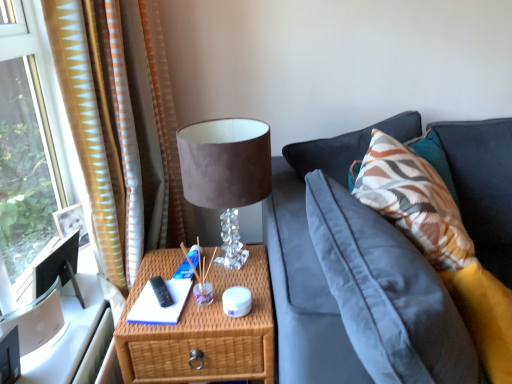
In order to click on gold striped curtain at left in this screenshot , I will do `click(121, 126)`.

Locate an element on the screen. The width and height of the screenshot is (512, 384). woven wood nightstand at lower center is located at coordinates (201, 329).

Which of these two, white paper at center or patterned fabric pillow at right, is bigger?

With larger size is patterned fabric pillow at right.

Does white paper at center turn towards patterned fabric pillow at right?

No, white paper at center is not aimed at patterned fabric pillow at right.

Is white paper at center next to patterned fabric pillow at right?

No, white paper at center is not next to patterned fabric pillow at right.

Is white paper at center outside of suede-like brown table lamp at upper center?

white paper at center is positioned outside suede-like brown table lamp at upper center.

Does white paper at center have a greater height compared to suede-like brown table lamp at upper center?

No, white paper at center is not taller than suede-like brown table lamp at upper center.

Does white paper at center have a greater width compared to suede-like brown table lamp at upper center?

In fact, white paper at center might be narrower than suede-like brown table lamp at upper center.

From the image's perspective, is white paper at center beneath suede-like brown table lamp at upper center?

Indeed, from the image's perspective, white paper at center is shown beneath suede-like brown table lamp at upper center.

Is gold striped curtain at left placed right next to suede-like brown table lamp at upper center?

No, gold striped curtain at left is not in contact with suede-like brown table lamp at upper center.

Is gold striped curtain at left taller than suede-like brown table lamp at upper center?

Yes, gold striped curtain at left is taller than suede-like brown table lamp at upper center.

How far apart are gold striped curtain at left and suede-like brown table lamp at upper center?

gold striped curtain at left is 36.32 centimeters from suede-like brown table lamp at upper center.

In the scene shown: In the image, is gold striped curtain at left positioned in front of or behind suede-like brown table lamp at upper center?

gold striped curtain at left is positioned farther from the viewer than suede-like brown table lamp at upper center.

Which object is more forward, suede-like brown table lamp at upper center or gold striped curtain at left?

Positioned in front is suede-like brown table lamp at upper center.

Can you confirm if suede-like brown table lamp at upper center is taller than gold striped curtain at left?

Incorrect, the height of suede-like brown table lamp at upper center is not larger of that of gold striped curtain at left.

Locate an element on the screen. curtain behind the suede-like brown table lamp at upper center is located at coordinates (121, 126).

Does white paper at center have a smaller size compared to woven wood nightstand at lower center?

Correct, white paper at center occupies less space than woven wood nightstand at lower center.

Locate an element on the screen. book behind the woven wood nightstand at lower center is located at coordinates (159, 304).

Visually, is white paper at center positioned to the left or to the right of woven wood nightstand at lower center?

Clearly, white paper at center is on the left of woven wood nightstand at lower center in the image.

Considering the sizes of objects white paper at center and woven wood nightstand at lower center in the image provided, who is taller, white paper at center or woven wood nightstand at lower center?

With more height is woven wood nightstand at lower center.

Is white paper at center surrounded by woven wood nightstand at lower center?

Yes, woven wood nightstand at lower center is surrounding white paper at center.

From the image's perspective, which one is positioned higher, woven wood nightstand at lower center or white paper at center?

white paper at center, from the image's perspective.

Is woven wood nightstand at lower center smaller than white paper at center?

No.

Which object is further away from the camera, patterned fabric pillow at right or gold striped curtain at left?

gold striped curtain at left is behind.

In the scene shown: Which object is thinner, patterned fabric pillow at right or gold striped curtain at left?

gold striped curtain at left is thinner.

Measure the distance between patterned fabric pillow at right and gold striped curtain at left.

patterned fabric pillow at right is 31.60 inches from gold striped curtain at left.

Can you confirm if patterned fabric pillow at right is taller than gold striped curtain at left?

No, patterned fabric pillow at right is not taller than gold striped curtain at left.

This screenshot has height=384, width=512. Find the location of `pillow above the white paper at center (from a real-world perspective)`. pillow above the white paper at center (from a real-world perspective) is located at coordinates (413, 201).

Locate an element on the screen. table lamp that appears in front of the white paper at center is located at coordinates (226, 173).

From the image, which object appears to be farther from patterned fabric pillow at right, white paper at center or suede-like brown table lamp at upper center?

Based on the image, white paper at center appears to be further to patterned fabric pillow at right.

Considering their positions, is patterned fabric pillow at right positioned further to white paper at center than suede-like brown table lamp at upper center?

The object further to white paper at center is patterned fabric pillow at right.

In the scene shown: From the image, which object appears to be nearer to suede-like brown table lamp at upper center, gold striped curtain at left or white paper at center?

The object closer to suede-like brown table lamp at upper center is gold striped curtain at left.

When comparing their distances from gold striped curtain at left, does woven wood nightstand at lower center or patterned fabric pillow at right seem further?

Based on the image, patterned fabric pillow at right appears to be further to gold striped curtain at left.

From the image, which object appears to be nearer to woven wood nightstand at lower center, white paper at center or gold striped curtain at left?

Based on the image, white paper at center appears to be nearer to woven wood nightstand at lower center.

Looking at the image, which one is located further to patterned fabric pillow at right, suede-like brown table lamp at upper center or woven wood nightstand at lower center?

woven wood nightstand at lower center is further to patterned fabric pillow at right.

Looking at the image, which one is located closer to gold striped curtain at left, patterned fabric pillow at right or suede-like brown table lamp at upper center?

suede-like brown table lamp at upper center is closer to gold striped curtain at left.

Looking at the image, which one is located further to patterned fabric pillow at right, white paper at center or gold striped curtain at left?

Among the two, gold striped curtain at left is located further to patterned fabric pillow at right.

You are a GUI agent. You are given a task and a screenshot of the screen. Output one action in this format:
    pyautogui.click(x=<x>, y=<y>)
    Task: Click on the book that lies between suede-like brown table lamp at upper center and woven wood nightstand at lower center from top to bottom
    
    Given the screenshot: What is the action you would take?
    pyautogui.click(x=159, y=304)

Where is `table lamp located between woven wood nightstand at lower center and patterned fabric pillow at right in the left-right direction`? table lamp located between woven wood nightstand at lower center and patterned fabric pillow at right in the left-right direction is located at coordinates (226, 173).

In order to click on nightstand between gold striped curtain at left and patterned fabric pillow at right in the horizontal direction in this screenshot , I will do `click(201, 329)`.

Where is `nightstand between white paper at center and patterned fabric pillow at right from left to right`? The width and height of the screenshot is (512, 384). nightstand between white paper at center and patterned fabric pillow at right from left to right is located at coordinates (201, 329).